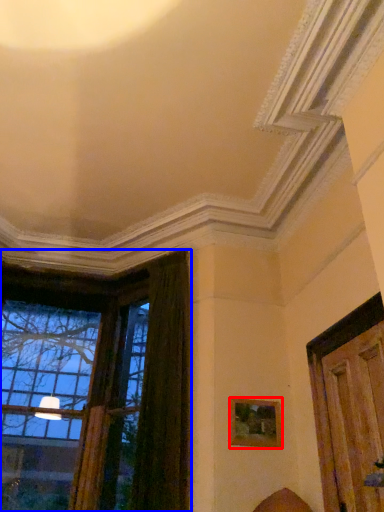
Question: Among these objects, which one is nearest to the camera, picture frame (highlighted by a red box) or window (highlighted by a blue box)?

Choices:
 (A) picture frame
 (B) window

Answer: (A)